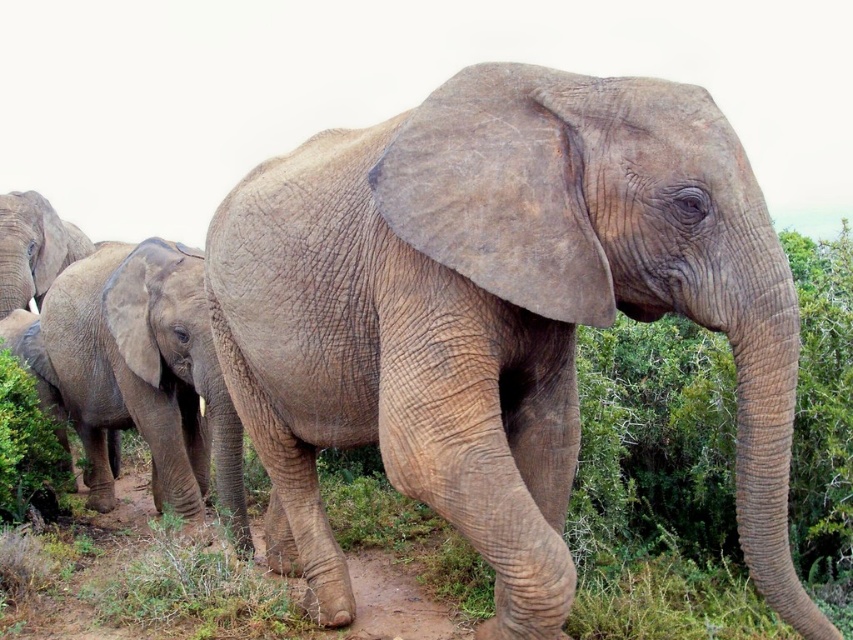
How far apart are gray textured elephant at center and gray textured baby elephant at lower left?

A distance of 6.78 feet exists between gray textured elephant at center and gray textured baby elephant at lower left.

This screenshot has height=640, width=853. Identify the location of gray textured elephant at center. (496, 316).

Does point (572, 193) come behind point (126, 397)?

No.

What are the coordinates of `gray textured elephant at center` in the screenshot? It's located at (496, 316).

Does gray textured elephant at center appear under gray textured elephant at upper left?

Yes.

Measure the distance between gray textured elephant at center and gray textured elephant at upper left.

They are 5.88 meters apart.

Is point (300, 465) more distant than point (49, 214)?

No.

What are the coordinates of `gray textured elephant at center` in the screenshot? It's located at (496, 316).

Is gray textured baby elephant at lower left shorter than gray textured elephant at upper left?

No.

Can you confirm if gray textured baby elephant at lower left is positioned above gray textured elephant at upper left?

No, gray textured baby elephant at lower left is not above gray textured elephant at upper left.

Locate an element on the screen. gray textured baby elephant at lower left is located at coordinates (144, 371).